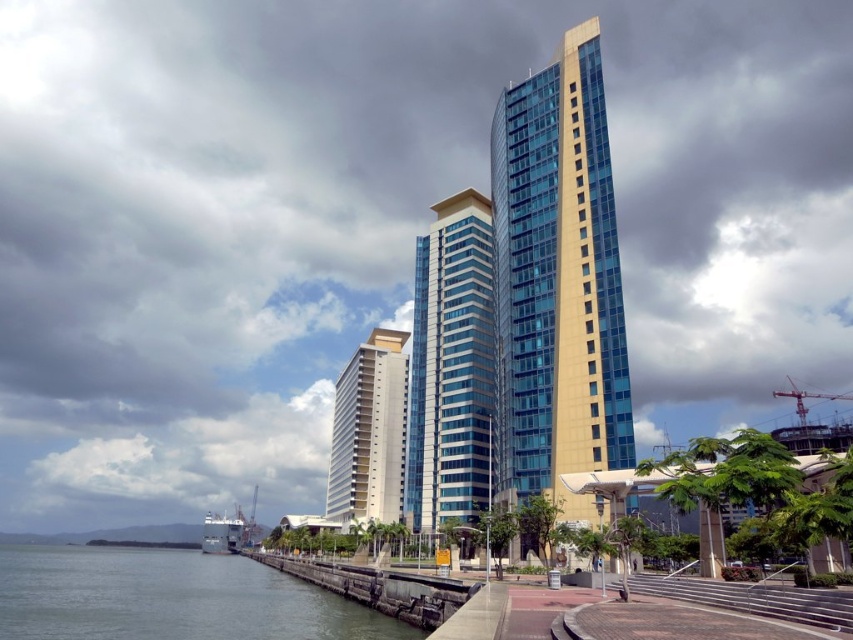
How far apart are gold glass building at center and green water at lower left?

gold glass building at center and green water at lower left are 50.41 meters apart from each other.

Does point (602, 364) come in front of point (39, 579)?

Yes.

Locate an element on the screen. The height and width of the screenshot is (640, 853). gold glass building at center is located at coordinates (556, 282).

Between sleek glass building at center and white smooth building at center, which one has less height?

white smooth building at center is shorter.

Image resolution: width=853 pixels, height=640 pixels. What do you see at coordinates (451, 365) in the screenshot?
I see `sleek glass building at center` at bounding box center [451, 365].

Consider the image. Who is more distant from viewer, (x=483, y=310) or (x=398, y=353)?

Point (x=398, y=353)

This screenshot has width=853, height=640. I want to click on sleek glass building at center, so click(x=451, y=365).

Does green water at lower left appear over sleek glass building at center?

Incorrect, green water at lower left is not positioned above sleek glass building at center.

Between point (71, 572) and point (440, 387), which one is positioned behind?

Point (440, 387)

Identify the location of green water at lower left. This screenshot has height=640, width=853. (170, 598).